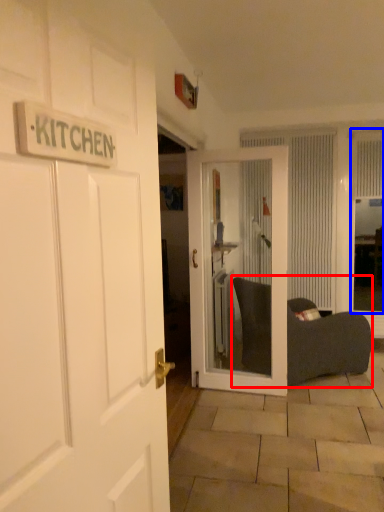
Question: Which object appears farthest to the camera in this image, bean bag chair (highlighted by a red box) or window screen (highlighted by a blue box)?

Choices:
 (A) bean bag chair
 (B) window screen

Answer: (B)